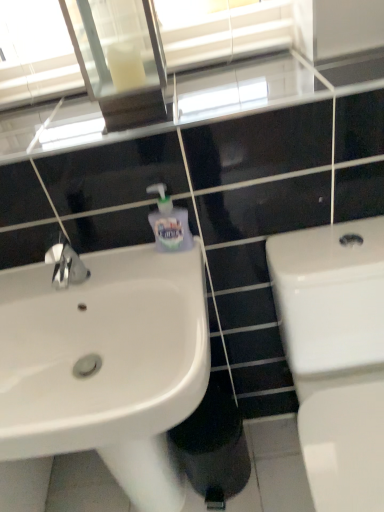
What are the coordinates of `translucent plastic soap dispenser at upper center` in the screenshot? It's located at (169, 223).

What is the approximate width of white glossy toilet at right?

The width of white glossy toilet at right is 23.26 inches.

This screenshot has width=384, height=512. What do you see at coordinates (85, 55) in the screenshot? I see `clear glass mirror at upper center` at bounding box center [85, 55].

Locate an element on the screen. The width and height of the screenshot is (384, 512). translucent plastic soap dispenser at upper center is located at coordinates (169, 223).

Is translucent plastic soap dispenser at upper center placed right next to clear glass mirror at upper center?

They are not placed beside each other.

From a real-world perspective, is translucent plastic soap dispenser at upper center on clear glass mirror at upper center?

Actually, translucent plastic soap dispenser at upper center is physically below clear glass mirror at upper center in the real world.

Considering the sizes of translucent plastic soap dispenser at upper center and clear glass mirror at upper center in the image, is translucent plastic soap dispenser at upper center wider or thinner than clear glass mirror at upper center?

Considering their sizes, translucent plastic soap dispenser at upper center looks slimmer than clear glass mirror at upper center.

Can you confirm if translucent plastic soap dispenser at upper center is positioned to the right of clear glass mirror at upper center?

Yes.

Is translucent plastic soap dispenser at upper center to the left or to the right of white glossy sink at left in the image?

Clearly, translucent plastic soap dispenser at upper center is on the right of white glossy sink at left in the image.

Does translucent plastic soap dispenser at upper center have a greater height compared to white glossy sink at left?

Incorrect, the height of translucent plastic soap dispenser at upper center is not larger of that of white glossy sink at left.

Does translucent plastic soap dispenser at upper center have a smaller size compared to white glossy sink at left?

Yes.

From a real-world perspective, does translucent plastic soap dispenser at upper center sit lower than white glossy sink at left?

No.

Considering the points (338, 309) and (166, 245), which point is behind, point (338, 309) or point (166, 245)?

The point (166, 245) is farther from the camera.

From a real-world perspective, is white glossy toilet at right above or below translucent plastic soap dispenser at upper center?

In terms of real-world spatial position, white glossy toilet at right is below translucent plastic soap dispenser at upper center.

Is white glossy toilet at right in contact with translucent plastic soap dispenser at upper center?

A: No, white glossy toilet at right is not beside translucent plastic soap dispenser at upper center.

In the scene shown: Considering the positions of objects white glossy toilet at right and translucent plastic soap dispenser at upper center in the image provided, who is more to the right, white glossy toilet at right or translucent plastic soap dispenser at upper center?

From the viewer's perspective, white glossy toilet at right appears more on the right side.

Is white glossy sink at left facing away from translucent plastic soap dispenser at upper center?

No, translucent plastic soap dispenser at upper center is not at the back of white glossy sink at left.

From a real-world perspective, between white glossy sink at left and translucent plastic soap dispenser at upper center, who is vertically higher?

translucent plastic soap dispenser at upper center.

The image size is (384, 512). In order to click on soap dispenser on the right of white glossy sink at left in this screenshot , I will do `click(169, 223)`.

Can you confirm if white glossy sink at left is shorter than translucent plastic soap dispenser at upper center?

No.

From a real-world perspective, which object stands above the other?

From a 3D spatial view, translucent plastic soap dispenser at upper center is above.

Between translucent plastic soap dispenser at upper center and white glossy toilet at right, which one has smaller size?

translucent plastic soap dispenser at upper center.

Is translucent plastic soap dispenser at upper center to the right of white glossy toilet at right from the viewer's perspective?

Incorrect, translucent plastic soap dispenser at upper center is not on the right side of white glossy toilet at right.

Does translucent plastic soap dispenser at upper center have a lesser height compared to white glossy toilet at right?

Yes.

Is point (110, 313) less distant than point (82, 18)?

Yes.

In terms of height, does white glossy sink at left look taller or shorter compared to clear glass mirror at upper center?

Considering their sizes, white glossy sink at left has less height than clear glass mirror at upper center.

Can you confirm if white glossy sink at left is thinner than clear glass mirror at upper center?

No.

Looking at this image, from a real-world perspective, between white glossy sink at left and clear glass mirror at upper center, who is vertically higher?

clear glass mirror at upper center is physically above.

Can you see white glossy sink at left touching white glossy toilet at right?

They are not placed beside each other.

Can you confirm if white glossy sink at left is thinner than white glossy toilet at right?

Yes.

Does white glossy sink at left turn towards white glossy toilet at right?

No, white glossy sink at left is not aimed at white glossy toilet at right.

At what (x,y) coordinates should I click in order to perform the action: click on soap dispenser beneath the clear glass mirror at upper center (from a real-world perspective). Please return your answer as a coordinate pair (x, y). Looking at the image, I should click on (169, 223).

You are a GUI agent. You are given a task and a screenshot of the screen. Output one action in this format:
    pyautogui.click(x=<x>, y=<y>)
    Task: Click on the soap dispenser above the white glossy sink at left (from a real-world perspective)
    The image size is (384, 512).
    Given the screenshot: What is the action you would take?
    pyautogui.click(x=169, y=223)

Estimate the real-world distances between objects in this image. Which object is further from translucent plastic soap dispenser at upper center, white glossy sink at left or white glossy toilet at right?

white glossy toilet at right is further to translucent plastic soap dispenser at upper center.

Looking at this image, considering their positions, is white glossy sink at left positioned further to white glossy toilet at right than translucent plastic soap dispenser at upper center?

Based on the image, translucent plastic soap dispenser at upper center appears to be further to white glossy toilet at right.

When comparing their distances from clear glass mirror at upper center, does translucent plastic soap dispenser at upper center or white glossy toilet at right seem closer?

The object closer to clear glass mirror at upper center is translucent plastic soap dispenser at upper center.

Considering their positions, is translucent plastic soap dispenser at upper center positioned closer to clear glass mirror at upper center than white glossy sink at left?

translucent plastic soap dispenser at upper center lies closer to clear glass mirror at upper center than the other object.

Looking at the image, which one is located closer to white glossy sink at left, clear glass mirror at upper center or translucent plastic soap dispenser at upper center?

translucent plastic soap dispenser at upper center lies closer to white glossy sink at left than the other object.

When comparing their distances from translucent plastic soap dispenser at upper center, does white glossy toilet at right or white glossy sink at left seem closer?

Based on the image, white glossy sink at left appears to be nearer to translucent plastic soap dispenser at upper center.

From the image, which object appears to be nearer to white glossy sink at left, clear glass mirror at upper center or white glossy toilet at right?

white glossy toilet at right is positioned closer to the anchor white glossy sink at left.

From the image, which object appears to be farther from white glossy toilet at right, translucent plastic soap dispenser at upper center or white glossy sink at left?

translucent plastic soap dispenser at upper center is positioned further to the anchor white glossy toilet at right.

I want to click on sink between clear glass mirror at upper center and white glossy toilet at right in the up-down direction, so click(106, 365).

The image size is (384, 512). In order to click on soap dispenser situated between white glossy sink at left and white glossy toilet at right from left to right in this screenshot , I will do `click(169, 223)`.

Identify the location of soap dispenser that lies between clear glass mirror at upper center and white glossy sink at left from top to bottom. (169, 223).

Where is `soap dispenser between clear glass mirror at upper center and white glossy toilet at right in the up-down direction`? soap dispenser between clear glass mirror at upper center and white glossy toilet at right in the up-down direction is located at coordinates (169, 223).